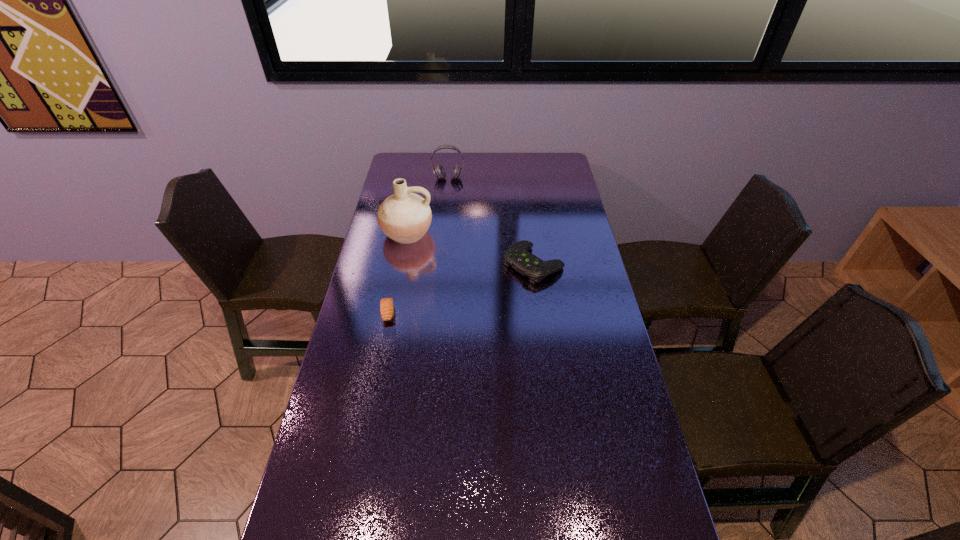
I want to click on the tallest object, so click(404, 217).

At what (x,y) coordinates should I click in order to perform the action: click on the second tallest object. Please return your answer as a coordinate pair (x, y). The image size is (960, 540). Looking at the image, I should click on (439, 172).

I want to click on headset, so click(439, 172).

You are a GUI agent. You are given a task and a screenshot of the screen. Output one action in this format:
    pyautogui.click(x=<x>, y=<y>)
    Task: Click on the rightmost object
    
    Given the screenshot: What is the action you would take?
    pyautogui.click(x=518, y=256)

This screenshot has height=540, width=960. Find the location of `control`. control is located at coordinates (518, 256).

I want to click on the nearest object, so click(386, 304).

The height and width of the screenshot is (540, 960). Identify the location of sushi. (386, 304).

Identify the location of free space located to pour from the handle of the pottery. (392, 312).

Find the location of `vacant position located 0.110m on the headband and ear cups of the farthest object`. vacant position located 0.110m on the headband and ear cups of the farthest object is located at coordinates (446, 196).

Locate an element on the screen. Image resolution: width=960 pixels, height=540 pixels. vacant space located on the front of the control is located at coordinates (546, 368).